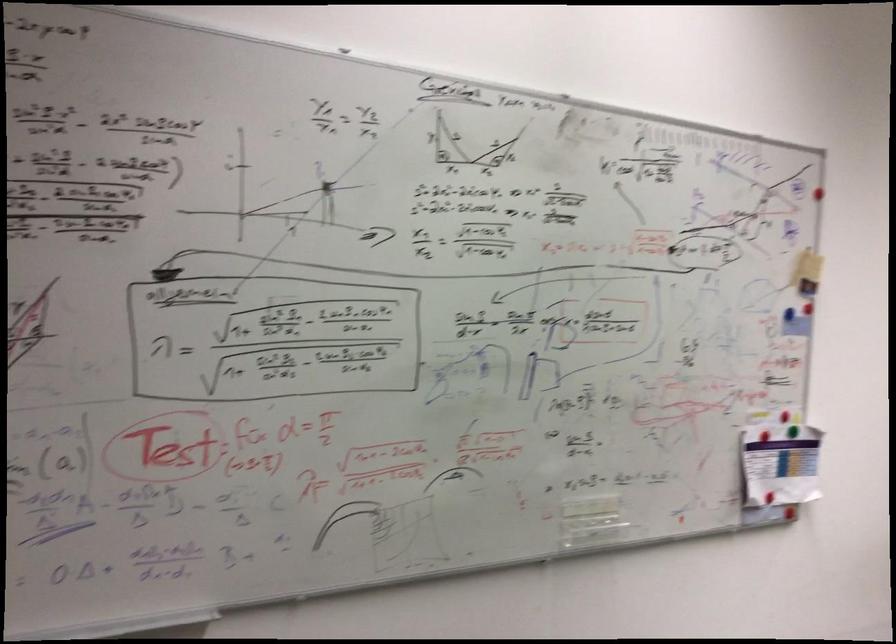
Find the location of `whiteboard pen tray`. whiteboard pen tray is located at coordinates (780, 464).